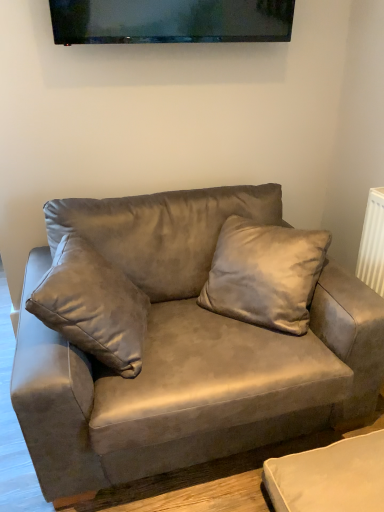
Question: Is suede gray couch at center facing away from suede pillow at center?

Choices:
 (A) no
 (B) yes

Answer: (B)

Question: From a real-world perspective, is suede gray couch at center located beneath suede pillow at center?

Choices:
 (A) yes
 (B) no

Answer: (A)

Question: Is suede gray couch at center bigger than suede pillow at center?

Choices:
 (A) no
 (B) yes

Answer: (B)

Question: Is the depth of suede gray couch at center greater than that of suede pillow at center?

Choices:
 (A) yes
 (B) no

Answer: (B)

Question: From a real-world perspective, is suede gray couch at center located higher than suede pillow at center?

Choices:
 (A) no
 (B) yes

Answer: (A)

Question: Considering the relative sizes of suede gray couch at center and suede pillow at center in the image provided, is suede gray couch at center wider than suede pillow at center?

Choices:
 (A) yes
 (B) no

Answer: (A)

Question: From a real-world perspective, is suede pillow at center beneath matte black tv at upper center?

Choices:
 (A) yes
 (B) no

Answer: (A)

Question: From the image's perspective, does suede pillow at center appear higher than matte black tv at upper center?

Choices:
 (A) yes
 (B) no

Answer: (B)

Question: Would you say suede pillow at center is outside matte black tv at upper center?

Choices:
 (A) no
 (B) yes

Answer: (B)

Question: Could you tell me if suede pillow at center is facing matte black tv at upper center?

Choices:
 (A) no
 (B) yes

Answer: (A)

Question: Does suede pillow at center lie behind matte black tv at upper center?

Choices:
 (A) no
 (B) yes

Answer: (A)

Question: Is suede pillow at center smaller than matte black tv at upper center?

Choices:
 (A) yes
 (B) no

Answer: (B)

Question: From the image's perspective, is matte black tv at upper center beneath suede gray couch at center?

Choices:
 (A) no
 (B) yes

Answer: (A)